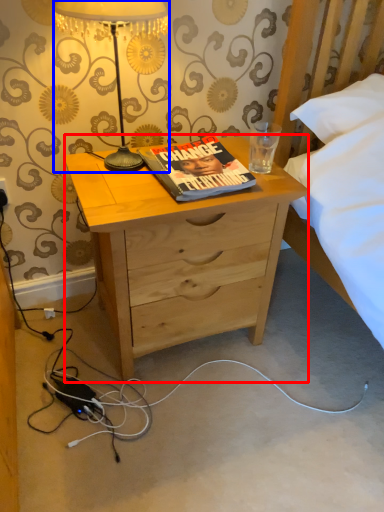
Question: Which object is closer to the camera taking this photo, desk (highlighted by a red box) or lamp (highlighted by a blue box)?

Choices:
 (A) desk
 (B) lamp

Answer: (B)